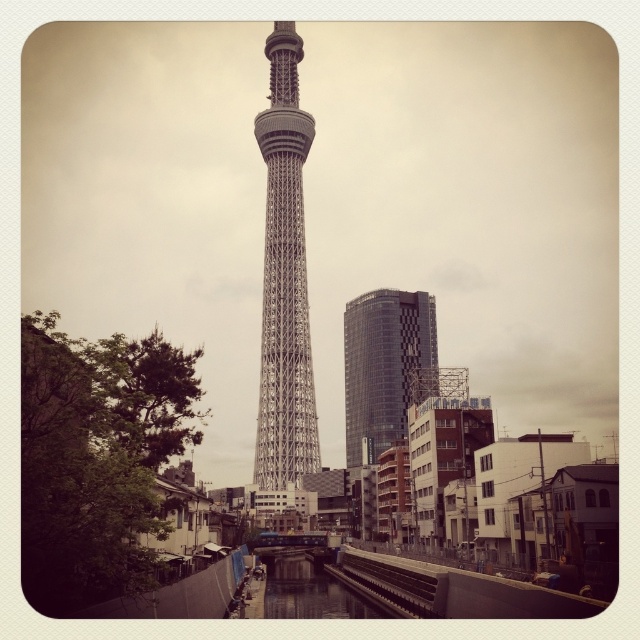
Which is in front, point (296, 262) or point (356, 365)?

Point (296, 262) is more forward.

This screenshot has height=640, width=640. Identify the location of silver metallic tower at center. (284, 278).